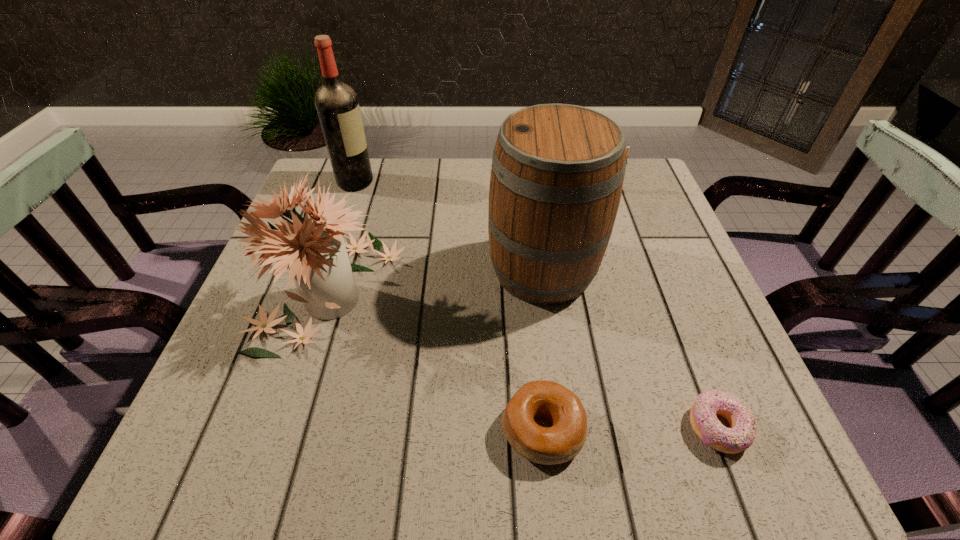
The width and height of the screenshot is (960, 540). I want to click on object situated at the far left corner, so click(337, 105).

I want to click on object located at the far right corner, so click(x=627, y=148).

Where is `object at the near right corner`? The image size is (960, 540). object at the near right corner is located at coordinates (742, 432).

Image resolution: width=960 pixels, height=540 pixels. Find the location of `vacant space at the far edge`. vacant space at the far edge is located at coordinates (470, 175).

Image resolution: width=960 pixels, height=540 pixels. I want to click on vacant space at the near edge of the desktop, so point(624,458).

The height and width of the screenshot is (540, 960). In the image, there is a desktop. In order to click on free space at the left edge in this screenshot , I will do `click(353, 220)`.

The width and height of the screenshot is (960, 540). I want to click on blank space at the right edge of the desktop, so pyautogui.click(x=685, y=262).

At what (x,y) coordinates should I click in order to perform the action: click on blank area at the near left corner. Please return your answer as a coordinate pair (x, y). Looking at the image, I should click on tap(279, 443).

Locate an element on the screen. Image resolution: width=960 pixels, height=540 pixels. free space at the far right corner is located at coordinates (644, 197).

Where is `vacant space in between the liquor and the candle`? vacant space in between the liquor and the candle is located at coordinates (477, 185).